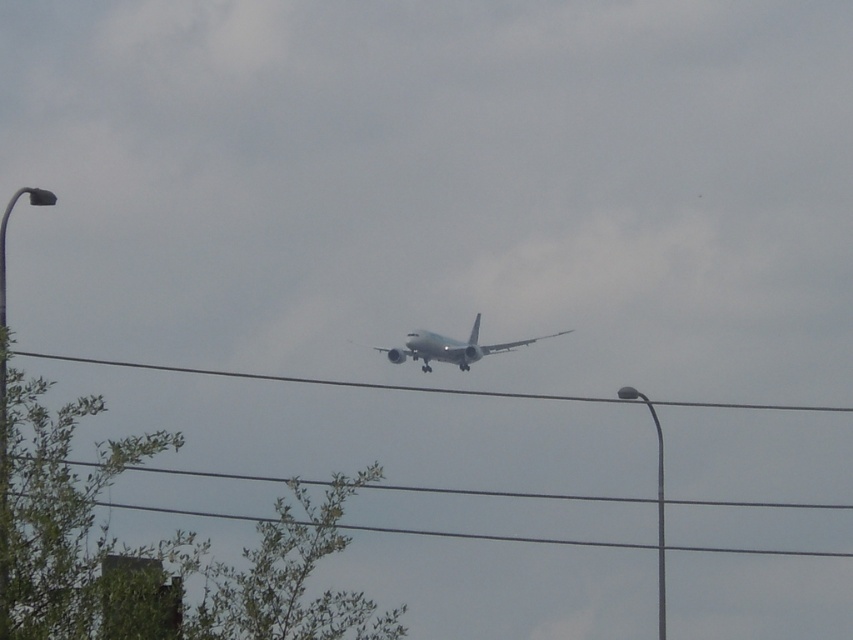
You are a pilot preparing for landing and notice two objects in your view ahead. The black wire at center and the white matte airplane at center. Which object is higher in your line of sight?

The black wire at center is higher than the white matte airplane at center in your line of sight.

You are a pilot trying to navigate your plane through a narrow passage between two obstacles. You see a black wire at center and a white matte airplane at center in your path. Which object is wider and might pose a greater obstruction?

The black wire at center is wider than the white matte airplane at center, so it poses a greater obstruction.

You are a pilot observing the white matte airplane at center and the green leafy tree at lower left from the cockpit. Which object appears larger in your view?

The green leafy tree at lower left appears larger in your view because it is described as bigger than the white matte airplane at center.